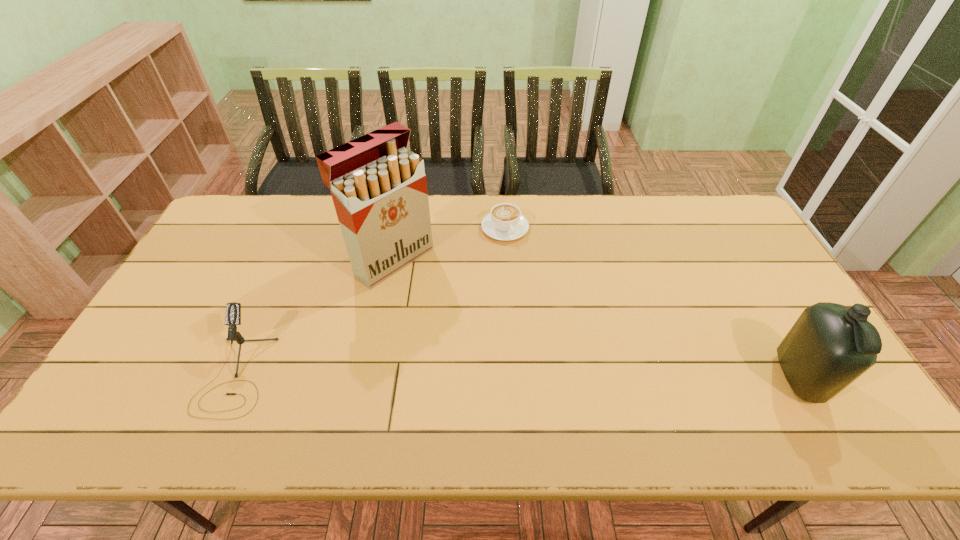
Where is `the third tallest object`? Image resolution: width=960 pixels, height=540 pixels. the third tallest object is located at coordinates coord(233,310).

At what (x,y) coordinates should I click in order to perform the action: click on microphone. Please return your answer as a coordinate pair (x, y). Image resolution: width=960 pixels, height=540 pixels. Looking at the image, I should click on (233, 310).

Where is `the rightmost object`? The image size is (960, 540). the rightmost object is located at coordinates (830, 345).

The height and width of the screenshot is (540, 960). Find the location of `bottle`. bottle is located at coordinates (830, 345).

In order to click on the shortest object in this screenshot , I will do `click(505, 222)`.

At what (x,y) coordinates should I click in order to perform the action: click on the third object from left to right. Please return your answer as a coordinate pair (x, y). This screenshot has height=540, width=960. Looking at the image, I should click on (505, 222).

The image size is (960, 540). What are the coordinates of `the third object from right to left` in the screenshot? It's located at (379, 189).

Find the location of `the tallest object`. the tallest object is located at coordinates (379, 189).

Find the location of `vacant area situated on the back of the second tallest object`. vacant area situated on the back of the second tallest object is located at coordinates (726, 251).

Locate an element on the screen. The height and width of the screenshot is (540, 960). vacant area located on the side of the cappuccino with the handle is located at coordinates (530, 278).